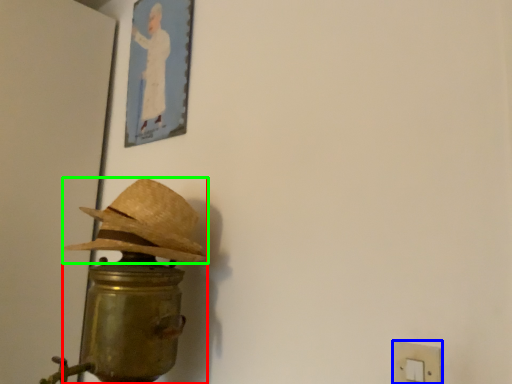
Question: Considering the real-world distances, which object is closest to table lamp (highlighted by a red box)? light switch (highlighted by a blue box) or hat (highlighted by a green box).

Choices:
 (A) light switch
 (B) hat

Answer: (B)